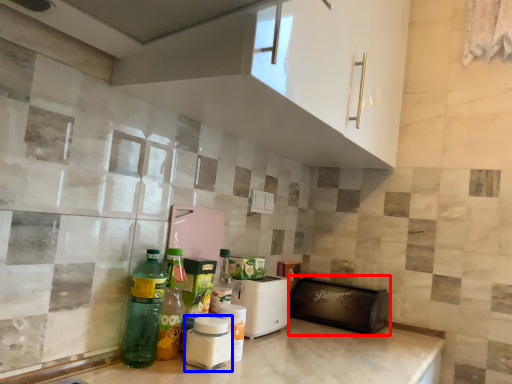
Question: Which of the following is the closest to the observer, appliance (highlighted by a red box) or bottle (highlighted by a blue box)?

Choices:
 (A) appliance
 (B) bottle

Answer: (B)